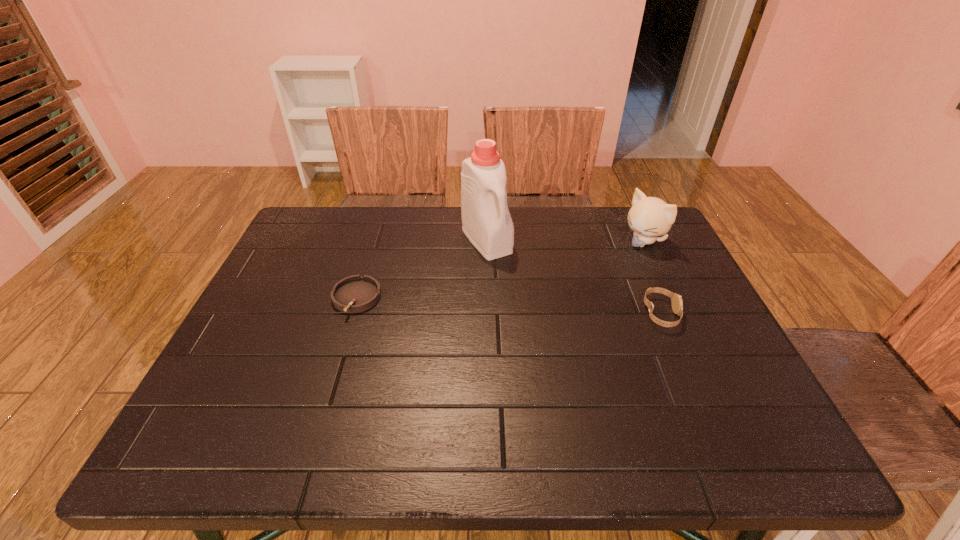
You are a GUI agent. You are given a task and a screenshot of the screen. Output one action in this format:
    pyautogui.click(x=<x>, y=<y>)
    Task: Click on the free spot between the kitten and the third tallest object
    This screenshot has width=960, height=540.
    Given the screenshot: What is the action you would take?
    point(652,278)

Locate an element on the screen. The image size is (960, 540). vacant area that lies between the second object from left to right and the second shortest object is located at coordinates (574, 277).

At what (x,y) coordinates should I click in order to perform the action: click on empty space between the second tallest object and the second shortest object. Please return your answer as a coordinate pair (x, y). The height and width of the screenshot is (540, 960). Looking at the image, I should click on (652, 278).

What are the coordinates of `vacant area between the kitten and the third object from right to left` in the screenshot? It's located at (564, 241).

The image size is (960, 540). I want to click on empty space that is in between the detergent and the ashtray, so click(x=421, y=269).

Identify which object is the nearest to the detergent. Please provide its 2D coordinates. Your answer should be formatted as a tuple, i.e. [(x, y)], where the tuple contains the x and y coordinates of a point satisfying the conditions above.

[(354, 294)]

Find the location of a particular element. The width and height of the screenshot is (960, 540). object that stands as the closest to the watch is located at coordinates (649, 217).

Find the location of `free spot that satisfies the following two spatial constraints: 1. on the front side of the second shortest object; 2. on the face of the leftmost object`. free spot that satisfies the following two spatial constraints: 1. on the front side of the second shortest object; 2. on the face of the leftmost object is located at coordinates (351, 314).

Where is `vacant position in the image that satisfies the following two spatial constraints: 1. on the back side of the tallest object; 2. on the left side of the ashtray`? vacant position in the image that satisfies the following two spatial constraints: 1. on the back side of the tallest object; 2. on the left side of the ashtray is located at coordinates (374, 240).